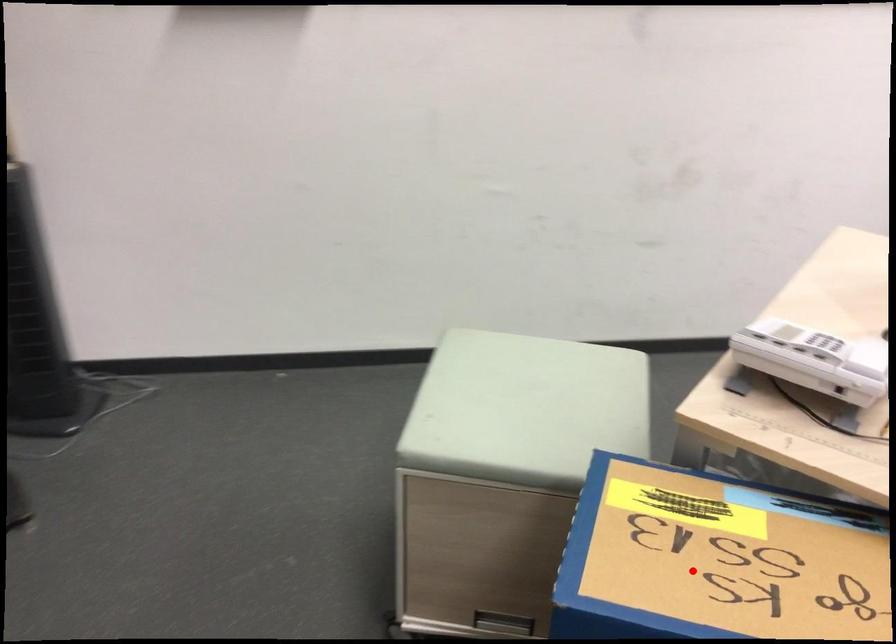
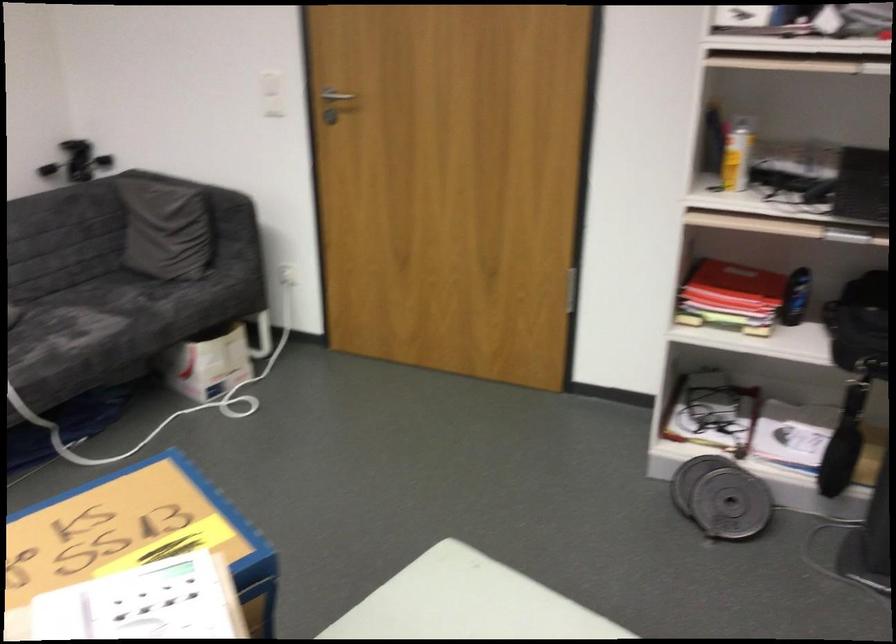
Question: I am providing you with two images of the same scene from different viewpoints. Given a red point in image1, look at the same physical point in image2. Is it:

Choices:
 (A) Closer to the viewpoint
 (B) Farther from the viewpoint

Answer: (B)